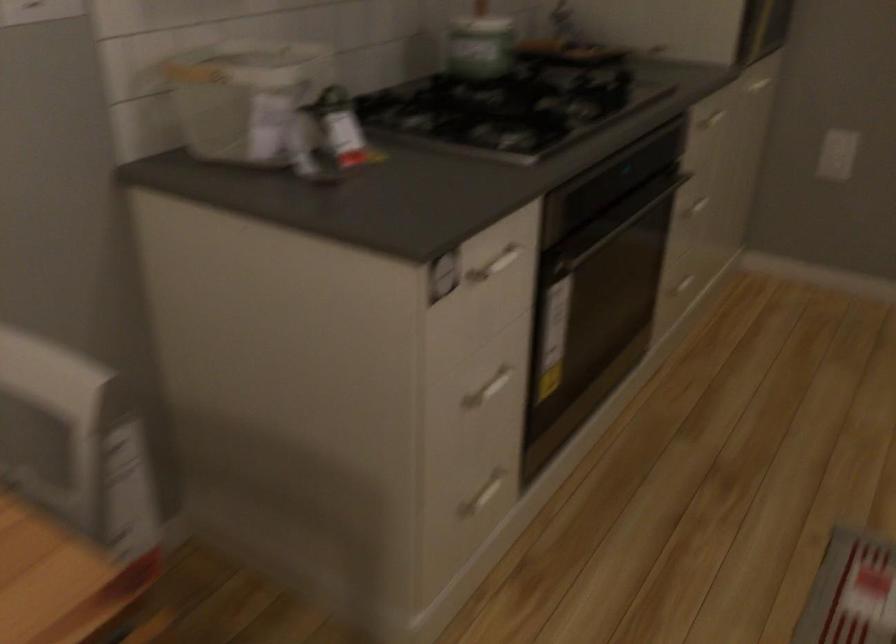
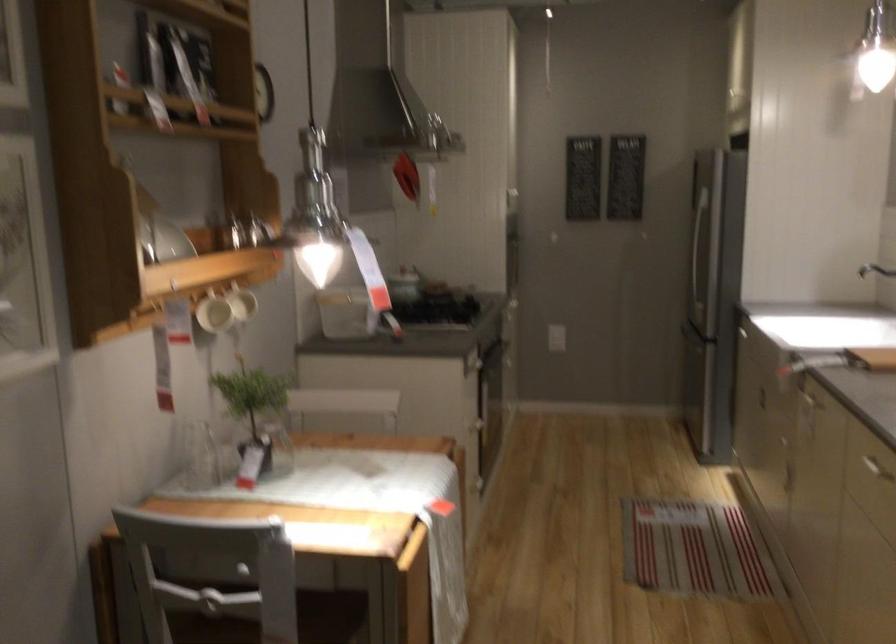
Question: I am providing you with two images of the same scene from different viewpoints. After the viewpoint changes to image2, which objects are now occluded?

Choices:
 (A) white mug handle
 (B) oven door handle
 (C) white drawer handle
 (D) black door handle

Answer: (C)